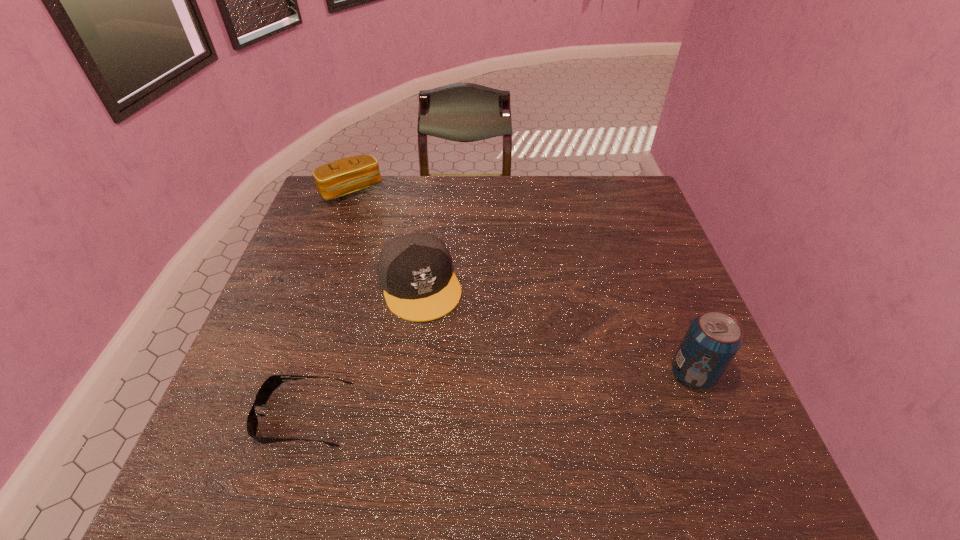
Find the location of a particular element. blank space located 0.170m on the zipper side of the farthest object is located at coordinates (380, 234).

This screenshot has width=960, height=540. In order to click on free spot located 0.050m on the zipper side of the farthest object in this screenshot , I will do `click(367, 212)`.

You are a GUI agent. You are given a task and a screenshot of the screen. Output one action in this format:
    pyautogui.click(x=<x>, y=<y>)
    Task: Click on the free location located 0.370m on the zipper side of the farthest object
    
    Given the screenshot: What is the action you would take?
    pyautogui.click(x=407, y=276)

Where is `object that is at the far edge`? Image resolution: width=960 pixels, height=540 pixels. object that is at the far edge is located at coordinates (349, 175).

Identify the location of sunglasses present at the near edge. (267, 388).

At what (x,y) coordinates should I click in order to perform the action: click on pop soda at the near edge. Please return your answer as a coordinate pair (x, y). Looking at the image, I should click on (712, 340).

The height and width of the screenshot is (540, 960). I want to click on sunglasses that is at the left edge, so click(267, 388).

The image size is (960, 540). I want to click on clutch bag at the left edge, so click(349, 175).

Identify the location of object situated at the right edge. The width and height of the screenshot is (960, 540). (712, 340).

Locate an element on the screen. The width and height of the screenshot is (960, 540). object located at the far left corner is located at coordinates (349, 175).